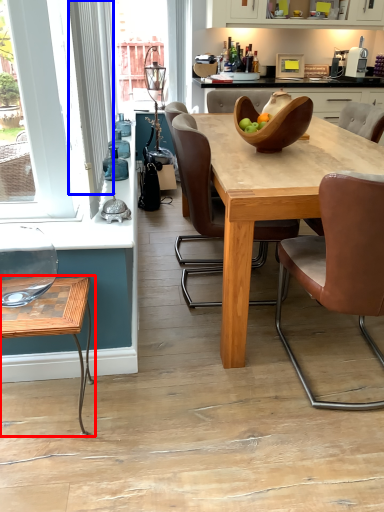
Question: Among these objects, which one is farthest to the camera, coffee table (highlighted by a red box) or curtain (highlighted by a blue box)?

Choices:
 (A) coffee table
 (B) curtain

Answer: (B)